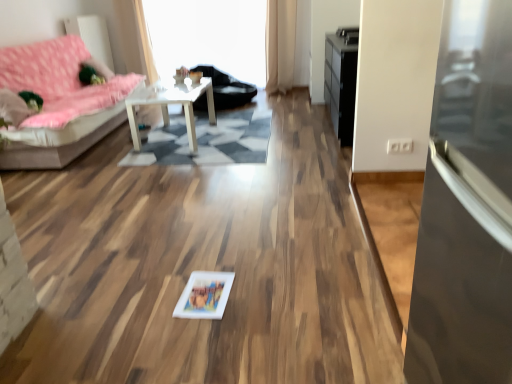
Question: From a real-world perspective, is transparent glass door at right physically below black leather armchair at center?

Choices:
 (A) no
 (B) yes

Answer: (A)

Question: Is transparent glass door at right further to the viewer compared to black leather armchair at center?

Choices:
 (A) no
 (B) yes

Answer: (A)

Question: Considering the relative sizes of transparent glass door at right and black leather armchair at center in the image provided, is transparent glass door at right bigger than black leather armchair at center?

Choices:
 (A) yes
 (B) no

Answer: (B)

Question: Can you confirm if transparent glass door at right is wider than black leather armchair at center?

Choices:
 (A) no
 (B) yes

Answer: (A)

Question: From the image's perspective, is transparent glass door at right on black leather armchair at center?

Choices:
 (A) yes
 (B) no

Answer: (B)

Question: Which is correct: beige fabric curtain at upper center is inside black leather armchair at center, or outside of it?

Choices:
 (A) outside
 (B) inside

Answer: (A)

Question: Looking at their shapes, would you say beige fabric curtain at upper center is wider or thinner than black leather armchair at center?

Choices:
 (A) wide
 (B) thin

Answer: (B)

Question: Considering the positions of beige fabric curtain at upper center and black leather armchair at center in the image, is beige fabric curtain at upper center bigger or smaller than black leather armchair at center?

Choices:
 (A) big
 (B) small

Answer: (B)

Question: Considering their positions, is beige fabric curtain at upper center located in front of or behind black leather armchair at center?

Choices:
 (A) front
 (B) behind

Answer: (B)

Question: Is transparent glass window screen at upper center situated inside white glossy table at center or outside?

Choices:
 (A) inside
 (B) outside

Answer: (B)

Question: Visually, is transparent glass window screen at upper center positioned to the left or to the right of white glossy table at center?

Choices:
 (A) left
 (B) right

Answer: (B)

Question: In terms of size, does transparent glass window screen at upper center appear bigger or smaller than white glossy table at center?

Choices:
 (A) big
 (B) small

Answer: (A)

Question: Considering their positions, is transparent glass window screen at upper center located in front of or behind white glossy table at center?

Choices:
 (A) behind
 (B) front

Answer: (A)

Question: Considering their positions, is black glossy dresser at upper right located in front of or behind white glossy picture frame at center?

Choices:
 (A) behind
 (B) front

Answer: (A)

Question: From the image's perspective, relative to white glossy picture frame at center, is black glossy dresser at upper right above or below?

Choices:
 (A) above
 (B) below

Answer: (A)